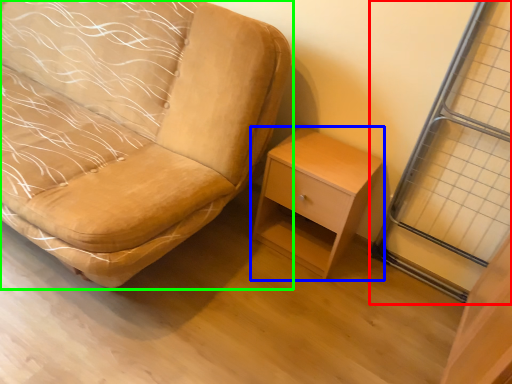
Question: Which object is the farthest from screen door (highlighted by a red box)? Choose among these: nightstand (highlighted by a blue box) or chair (highlighted by a green box).

Choices:
 (A) nightstand
 (B) chair

Answer: (B)